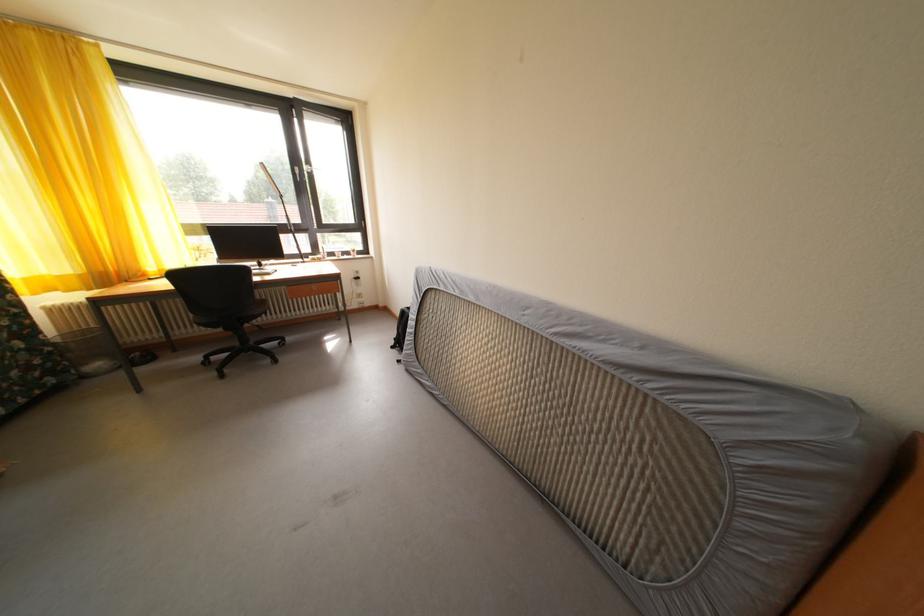
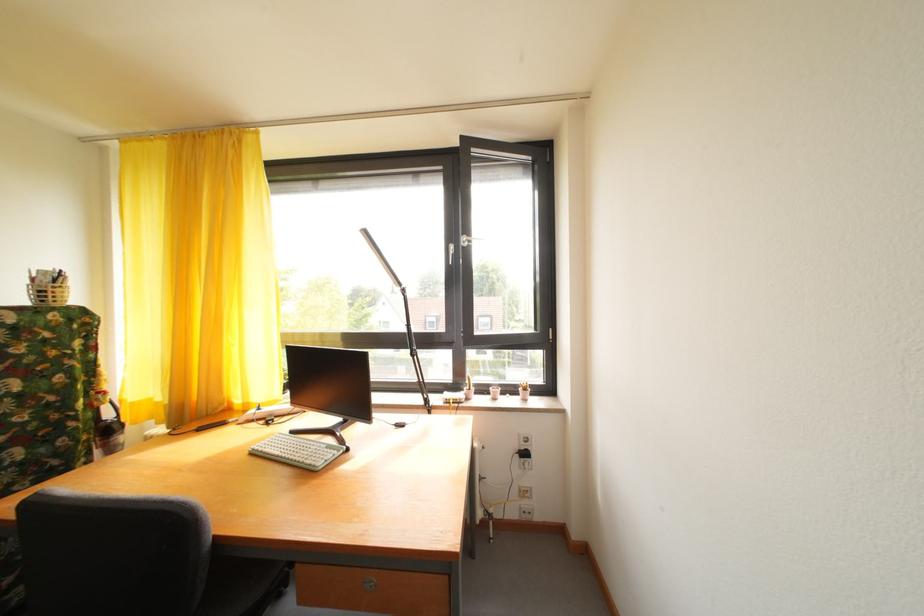
In the second image, find the point that corresponds to (x=341, y=261) in the first image.

(492, 395)